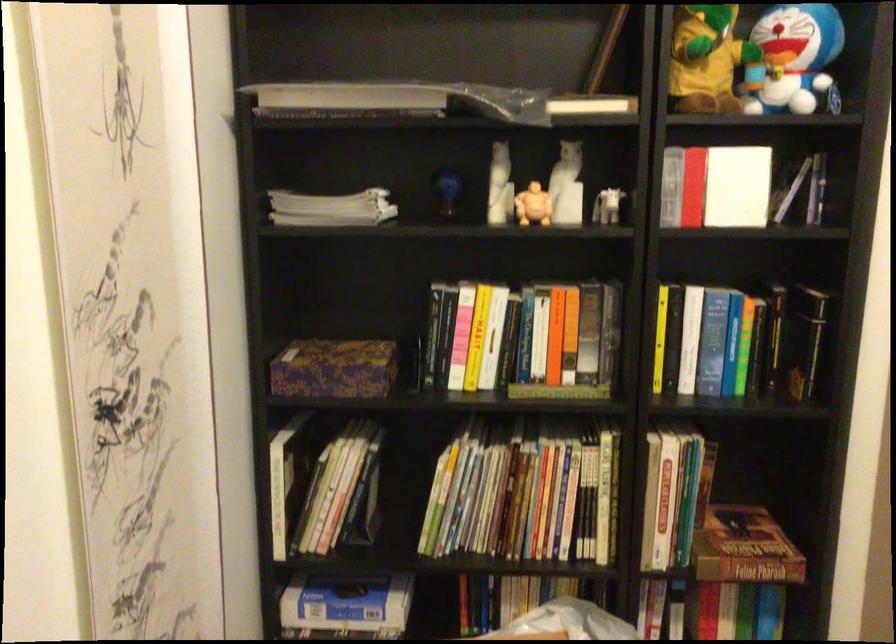
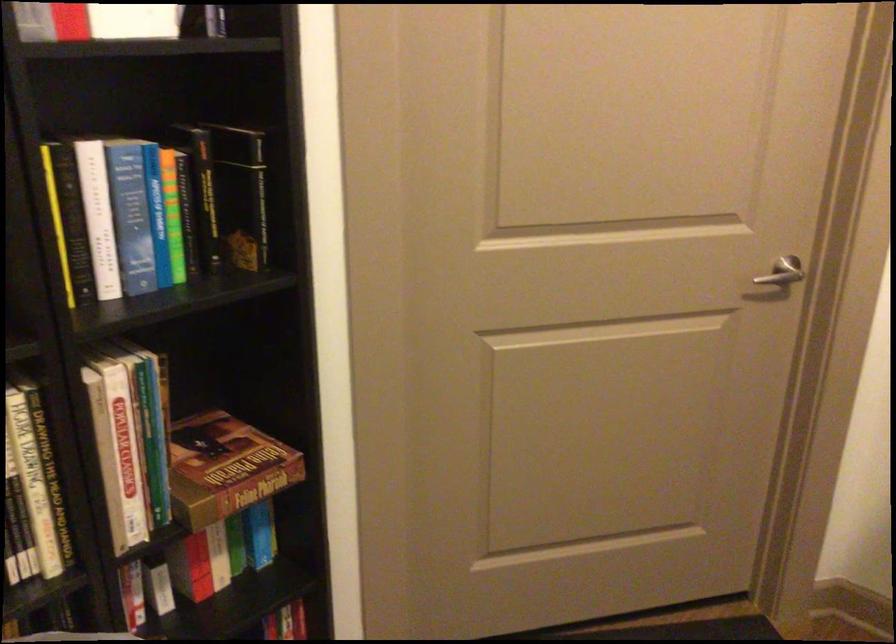
Find the pixel in the second image that matches the point at 810,335 in the first image.

(240, 194)